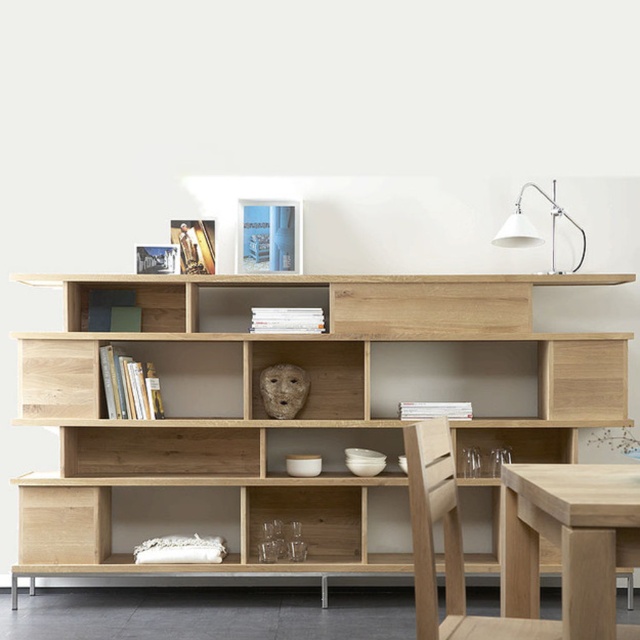
Question: Does natural wood bookcase at center have a larger size compared to white matte desk lamp at upper right?

Choices:
 (A) yes
 (B) no

Answer: (A)

Question: Which of the following is the farthest from the observer?

Choices:
 (A) (x=518, y=573)
 (B) (x=560, y=209)
 (C) (x=70, y=436)
 (D) (x=490, y=632)

Answer: (B)

Question: In this image, where is natural wood bookcase at center located relative to light wood chair at lower right?

Choices:
 (A) left
 (B) right

Answer: (A)

Question: Does light oak table at center have a lesser width compared to white matte desk lamp at upper right?

Choices:
 (A) yes
 (B) no

Answer: (A)

Question: Which of the following is the closest to the observer?

Choices:
 (A) natural wood bookcase at center
 (B) white matte desk lamp at upper right
 (C) light oak table at center

Answer: (C)

Question: Which object is farther from the camera taking this photo?

Choices:
 (A) natural wood bookcase at center
 (B) white matte desk lamp at upper right
 (C) light wood chair at lower right

Answer: (A)